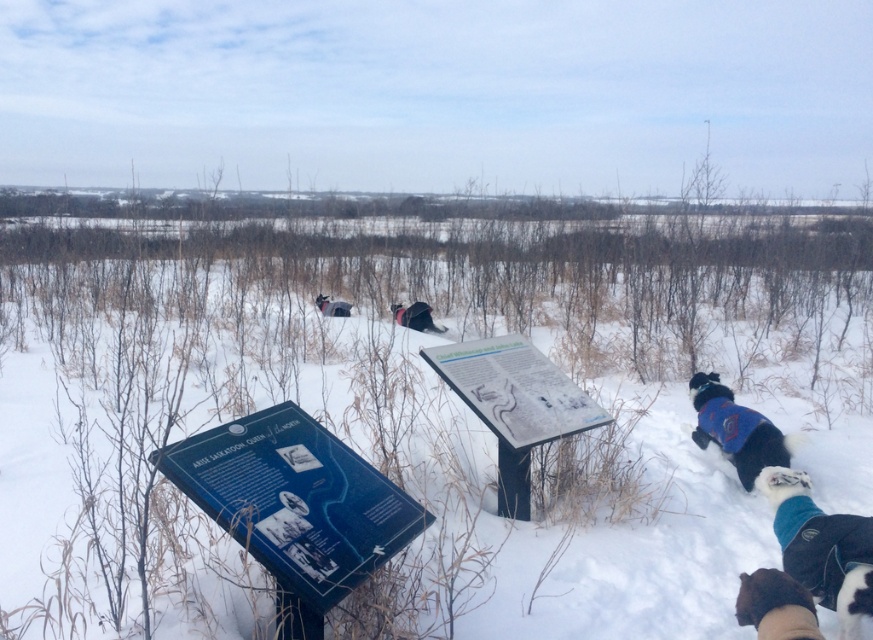
Who is shorter, white fur dog at lower right or black fuzzy dog at center?

Standing shorter between the two is black fuzzy dog at center.

Does white fur dog at lower right have a lesser height compared to black fuzzy dog at center?

No.

Which is in front, point (799, 492) or point (409, 307)?

Point (799, 492) is in front.

Find the location of a particular element. The image size is (873, 640). white fur dog at lower right is located at coordinates (821, 547).

Is white fluffy snow at center wider than white fur dog at lower right?

Yes, white fluffy snow at center is wider than white fur dog at lower right.

Which is below, white fluffy snow at center or white fur dog at lower right?

Positioned lower is white fur dog at lower right.

Between point (287, 323) and point (812, 500), which one is positioned in front?

Point (812, 500) is more forward.

This screenshot has height=640, width=873. I want to click on white fluffy snow at center, so pyautogui.click(x=418, y=394).

Is blue plastic sign at lower left to the right of black fuzzy dog at center from the viewer's perspective?

Incorrect, blue plastic sign at lower left is not on the right side of black fuzzy dog at center.

Does blue plastic sign at lower left have a greater width compared to black fuzzy dog at center?

Yes.

At what (x,y) coordinates should I click in order to perform the action: click on blue plastic sign at lower left. Please return your answer as a coordinate pair (x, y). This screenshot has width=873, height=640. Looking at the image, I should click on tap(294, 506).

Locate an element on the screen. This screenshot has height=640, width=873. blue plastic sign at lower left is located at coordinates (294, 506).